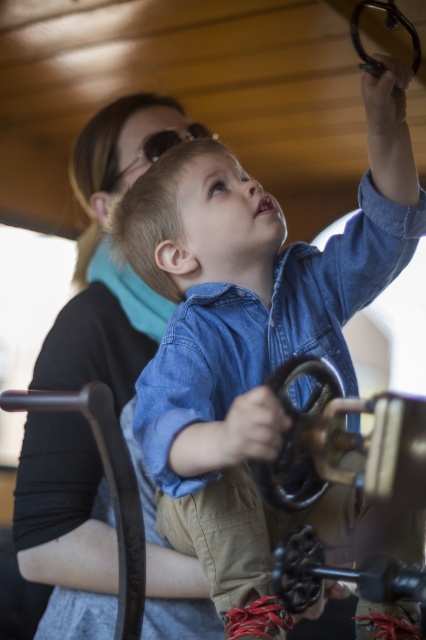
You are a safety inspector checking the equipment in the train. You see the denim shirt at upper center and the matte black goggles at upper center. Which one is positioned higher?

The denim shirt at upper center is taller than matte black goggles at upper center, so the denim shirt at upper center is positioned higher.

You are a tailor measuring garments in the image. The denim shirt at upper center and the matte black goggles at upper center are both in your view. Which item has a greater width?

The denim shirt at upper center has a greater width than the matte black goggles at upper center.